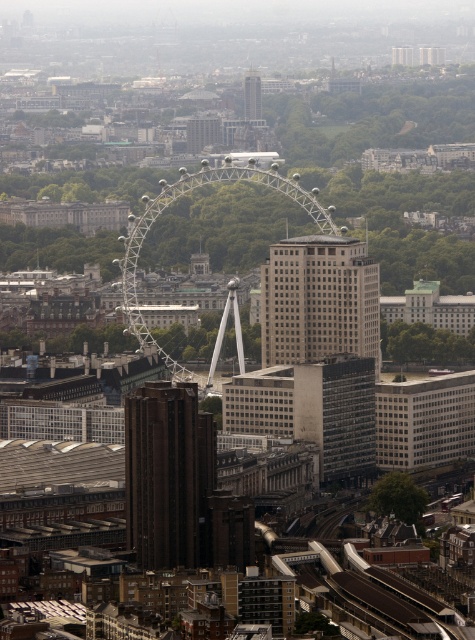
Who is shorter, brown textured building at center or matte glass tower at center?

With less height is matte glass tower at center.

Can you confirm if brown textured building at center is taller than matte glass tower at center?

Indeed, brown textured building at center has a greater height compared to matte glass tower at center.

Where is `brown textured building at center`? The width and height of the screenshot is (475, 640). brown textured building at center is located at coordinates (169, 474).

Can you confirm if gray concrete skyscraper at center is positioned below matte glass tower at center?

Yes, gray concrete skyscraper at center is below matte glass tower at center.

Does gray concrete skyscraper at center have a smaller size compared to matte glass tower at center?

No.

Which is in front, point (294, 241) or point (256, 115)?

Point (294, 241) is more forward.

The image size is (475, 640). I want to click on gray concrete skyscraper at center, so click(x=319, y=300).

Between gray concrete skyscraper at center and shiny metallic ferris wheel at center, which one has less height?

With less height is gray concrete skyscraper at center.

Identify the location of gray concrete skyscraper at center. Image resolution: width=475 pixels, height=640 pixels. (319, 300).